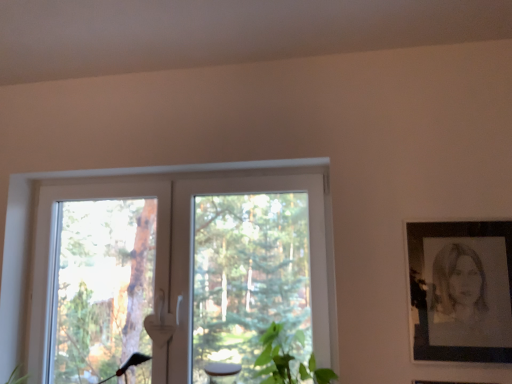
Question: From the image's perspective, would you say white plastic window at center is positioned over green leafy plant at lower center?

Choices:
 (A) yes
 (B) no

Answer: (A)

Question: Is white plastic window at center thinner than green leafy plant at lower center?

Choices:
 (A) yes
 (B) no

Answer: (A)

Question: Is white plastic window at center smaller than green leafy plant at lower center?

Choices:
 (A) no
 (B) yes

Answer: (A)

Question: Can green leafy plant at lower center be found inside white plastic window at center?

Choices:
 (A) yes
 (B) no

Answer: (A)

Question: Is white plastic window at center to the right of green leafy plant at lower center from the viewer's perspective?

Choices:
 (A) no
 (B) yes

Answer: (A)

Question: From the image's perspective, does white plastic window at center appear lower than green leafy plant at lower center?

Choices:
 (A) no
 (B) yes

Answer: (A)

Question: Would you say white plastic window at center is part of black paper portrait at right's contents?

Choices:
 (A) yes
 (B) no

Answer: (B)

Question: Does black paper portrait at right appear on the right side of white plastic window at center?

Choices:
 (A) no
 (B) yes

Answer: (B)

Question: Is black paper portrait at right smaller than white plastic window at center?

Choices:
 (A) yes
 (B) no

Answer: (A)

Question: Considering the relative sizes of black paper portrait at right and white plastic window at center in the image provided, is black paper portrait at right taller than white plastic window at center?

Choices:
 (A) yes
 (B) no

Answer: (B)

Question: Would you say black paper portrait at right is a long distance from white plastic window at center?

Choices:
 (A) no
 (B) yes

Answer: (A)

Question: Considering the relative sizes of black paper portrait at right and white plastic window at center in the image provided, is black paper portrait at right shorter than white plastic window at center?

Choices:
 (A) no
 (B) yes

Answer: (B)

Question: From a real-world perspective, is black paper portrait at right beneath green leafy plant at lower center?

Choices:
 (A) yes
 (B) no

Answer: (B)